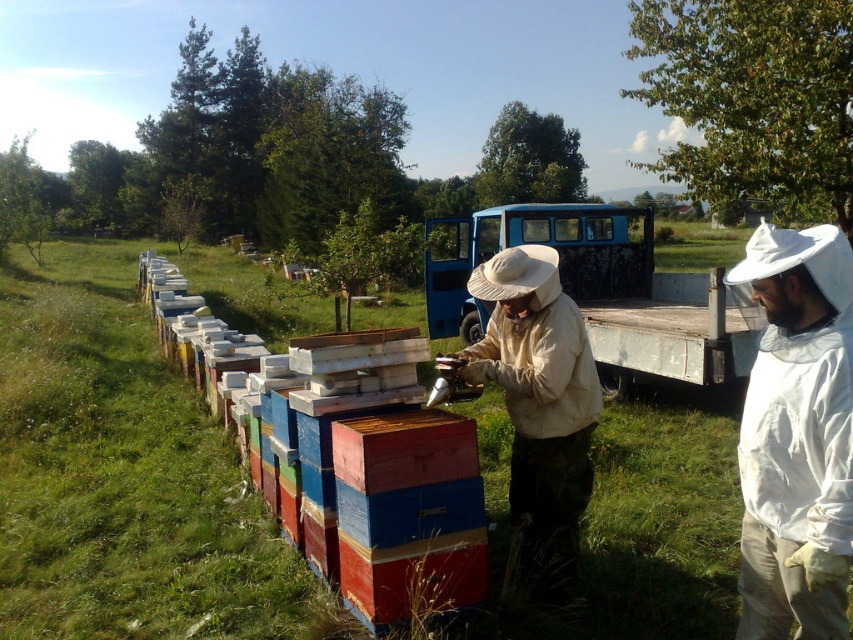
Does wooden beehive at left have a lesser width compared to white cotton beekeeper suit at center?

No.

Is point (146, 262) more distant than point (552, 316)?

Yes.

Is point (390, 499) closer to viewer compared to point (560, 328)?

Yes, point (390, 499) is in front of point (560, 328).

Locate an element on the screen. The height and width of the screenshot is (640, 853). wooden beehive at left is located at coordinates (350, 474).

Is wooden beehive at left further to camera compared to white matte beekeeper suit at center?

That is True.

Does wooden beehive at left have a greater height compared to white matte beekeeper suit at center?

Correct, wooden beehive at left is much taller as white matte beekeeper suit at center.

Between point (387, 477) and point (833, 396), which one is positioned in front?

Point (833, 396) is more forward.

Where is `wooden beehive at left`? wooden beehive at left is located at coordinates tap(350, 474).

Is white matte beekeeper suit at center taller than white cotton beekeeper suit at center?

No.

Who is positioned more to the right, white matte beekeeper suit at center or white cotton beekeeper suit at center?

Positioned to the right is white matte beekeeper suit at center.

Which is behind, point (766, 433) or point (553, 467)?

The point (553, 467) is more distant.

Locate an element on the screen. This screenshot has height=640, width=853. white matte beekeeper suit at center is located at coordinates (798, 436).